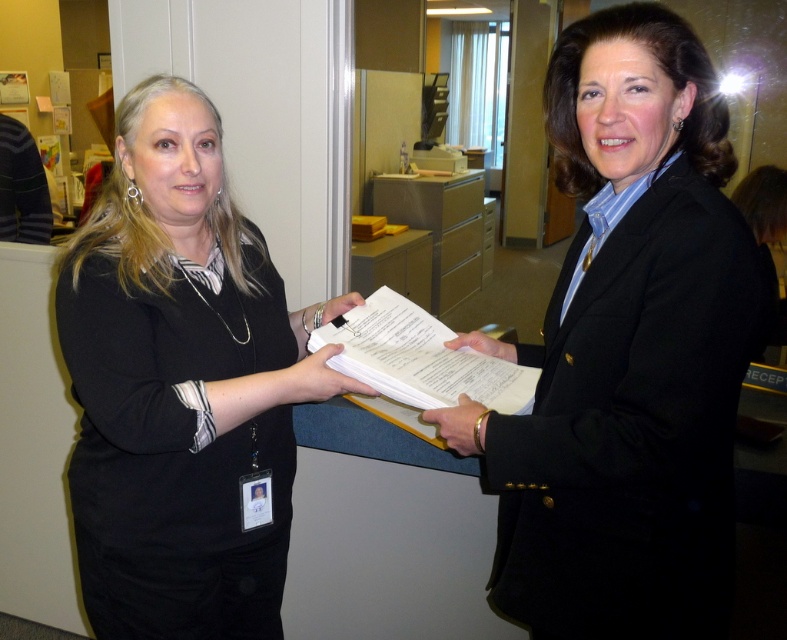
Who is more forward, (x=597, y=26) or (x=143, y=141)?

Point (x=597, y=26) is more forward.

Which is above, black matte blazer at center or matte black shirt at center?

Positioned higher is black matte blazer at center.

The width and height of the screenshot is (787, 640). I want to click on black matte blazer at center, so click(x=627, y=353).

Identify the location of black matte blazer at center. click(x=627, y=353).